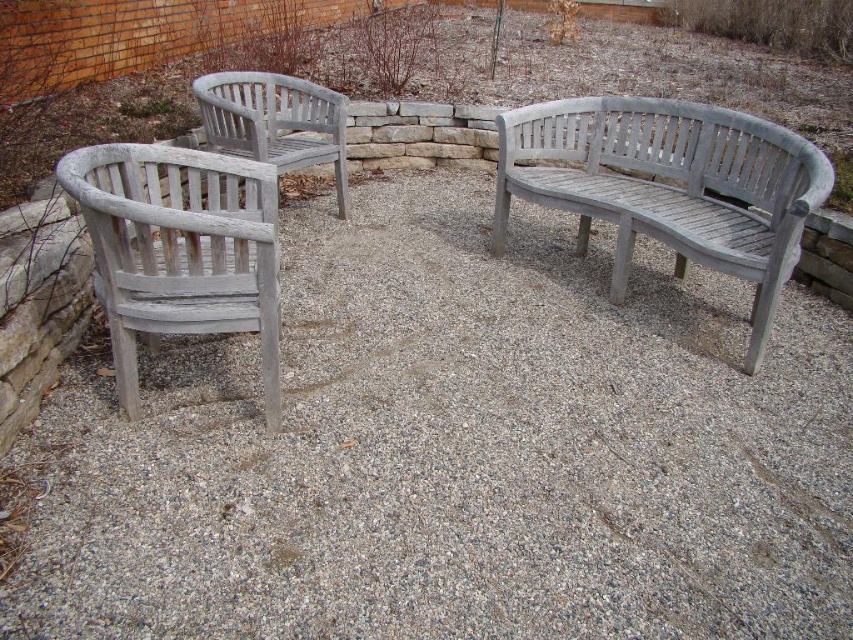
You are standing in the outdoor seating area and want to place a small potted plant between the gray gravel at center and the gray wood bench at center. Which object should you place it closer to if you want the plant to be in front of the bench?

You should place the small potted plant closer to the gray gravel at center because the gray gravel at center is closer to the viewer than the gray wood bench at center, making it in front of the bench.

Looking at this image, you are planning to place a new rectangular table between the gray gravel at center and the white weathered wood chair at left. The table is 1.2 meters wide. Can the table fit between them without overlapping either object?

The gray gravel at center is wider than the white weathered wood chair at left. Since the table is 1.2 meters wide, it depends on the actual width of the space between them. However, the description only states that the gravel is wider, not the exact measurement, so we cannot confirm if it will fit without more information.

You are standing at the entrance of the outdoor seating area and want to place a new bench exactly at the center of the seating area. According to the image, where should you position the bench relative to the gray gravel at center?

The gray gravel at center is located at point (456, 451), so you should position the new bench at the same coordinates to place it exactly at the center of the seating area.